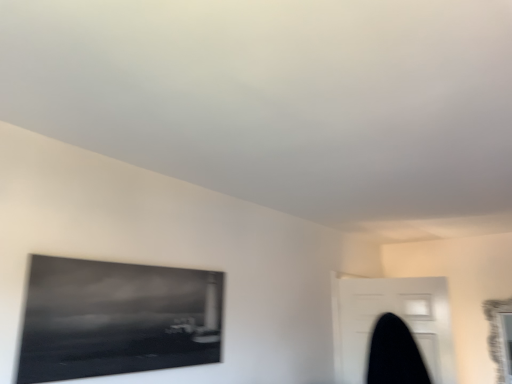
In order to click on black matte door at lower right in this screenshot , I will do `click(396, 314)`.

What do you see at coordinates (396, 314) in the screenshot?
I see `black matte door at lower right` at bounding box center [396, 314].

Measure the distance between black matte door at lower right and camera.

The distance of black matte door at lower right from camera is 2.83 meters.

The height and width of the screenshot is (384, 512). Identify the location of black matte door at lower right. (396, 314).